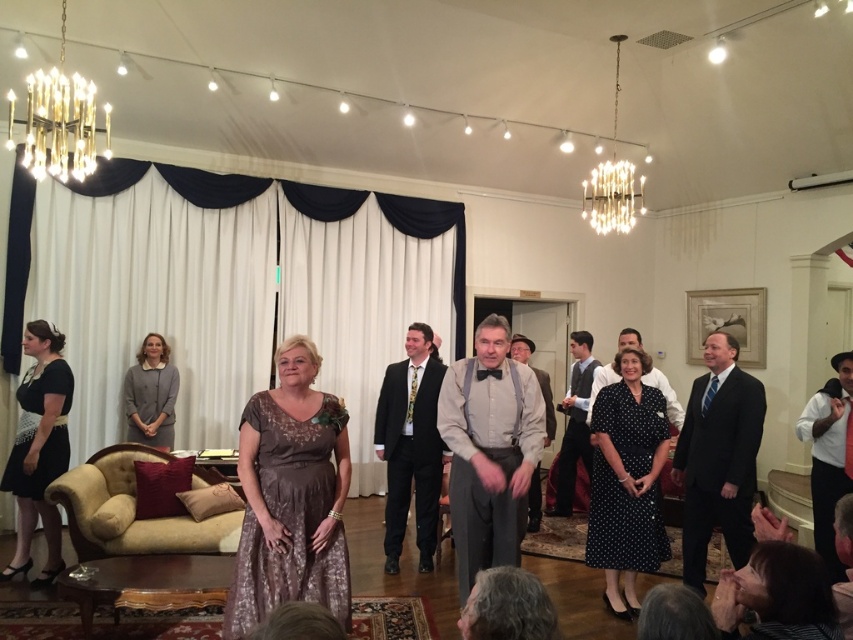
Who is positioned more to the right, black satin dress at left or dark gray vest at center?

dark gray vest at center is more to the right.

Find the location of `black satin dress at left`. black satin dress at left is located at coordinates (39, 449).

I want to click on black satin dress at left, so click(39, 449).

Is light gray fabric bow tie at center above black satin dress at left?

Correct, light gray fabric bow tie at center is located above black satin dress at left.

Which of these two, light gray fabric bow tie at center or black satin dress at left, stands shorter?

With less height is light gray fabric bow tie at center.

Which is in front, point (456, 417) or point (20, 413)?

Point (456, 417) is more forward.

I want to click on light gray fabric bow tie at center, so click(x=489, y=451).

Does point (643, 564) lie behind point (428, 536)?

No, (643, 564) is in front of (428, 536).

Who is positioned more to the right, black dotted fabric dress at center or black satin suit at center?

black dotted fabric dress at center is more to the right.

You are a GUI agent. You are given a task and a screenshot of the screen. Output one action in this format:
    pyautogui.click(x=<x>, y=<y>)
    Task: Click on the black dotted fabric dress at center
    
    Given the screenshot: What is the action you would take?
    pyautogui.click(x=624, y=522)